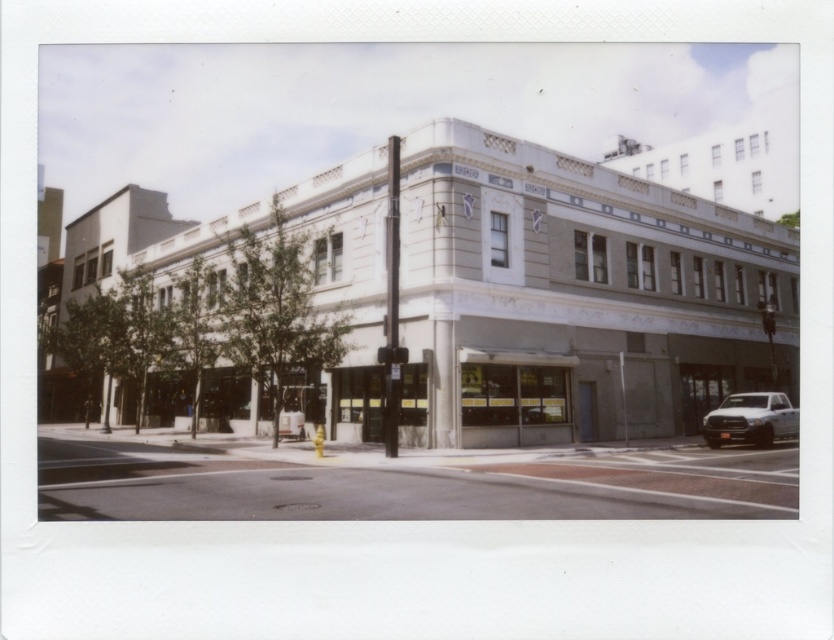
You are standing on the street in front of the building and want to walk to the blue door on the right side of the ground floor. Which object, the concrete sidewalk at lower center or the white matte truck at lower right, will you encounter first as you approach the blue door?

You will encounter the concrete sidewalk at lower center first because it is closer to the viewer than the white matte truck at lower right.

You are a delivery person who needs to unload a large package from your white matte truck at lower right onto the concrete sidewalk at lower center. Considering the sizes of both areas, will there be enough space to maneuver the package without it going off the sidewalk?

The concrete sidewalk at lower center has a larger size compared to the white matte truck at lower right, so there should be sufficient space to maneuver the package onto the sidewalk without it going off the edge.